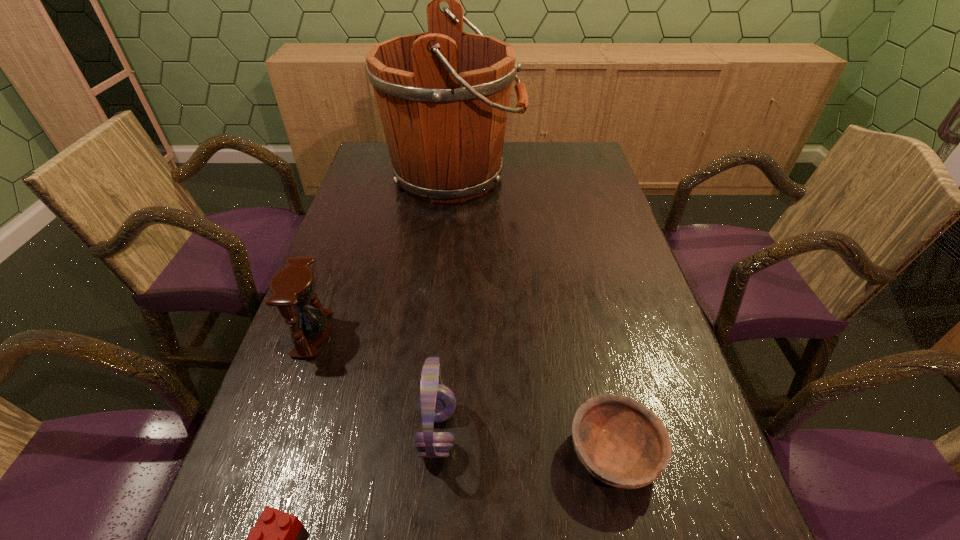
Image resolution: width=960 pixels, height=540 pixels. I want to click on object at the far edge, so click(x=443, y=96).

Locate an element on the screen. bucket located in the left edge section of the desktop is located at coordinates (443, 96).

You are a GUI agent. You are given a task and a screenshot of the screen. Output one action in this format:
    pyautogui.click(x=<x>, y=<y>)
    Task: Click on the hourglass that is at the left edge
    
    Given the screenshot: What is the action you would take?
    pyautogui.click(x=293, y=286)

Locate an element on the screen. object that is at the right edge is located at coordinates (622, 443).

The width and height of the screenshot is (960, 540). In order to click on object at the far left corner in this screenshot , I will do `click(443, 96)`.

At what (x,y) coordinates should I click in order to perform the action: click on free space at the left edge of the desktop. Please return your answer as a coordinate pair (x, y). Looking at the image, I should click on (372, 286).

The height and width of the screenshot is (540, 960). I want to click on vacant space at the right edge of the desktop, so click(599, 262).

This screenshot has width=960, height=540. In order to click on free space at the far right corner of the desktop in this screenshot , I will do `click(549, 147)`.

You are a GUI agent. You are given a task and a screenshot of the screen. Output one action in this format:
    pyautogui.click(x=<x>, y=<y>)
    Task: Click on the unoccupied area between the tallest object and the headset
    The image size is (960, 540).
    Given the screenshot: What is the action you would take?
    pyautogui.click(x=445, y=303)

Locate an element on the screen. free area in between the bucket and the rightmost object is located at coordinates (534, 315).